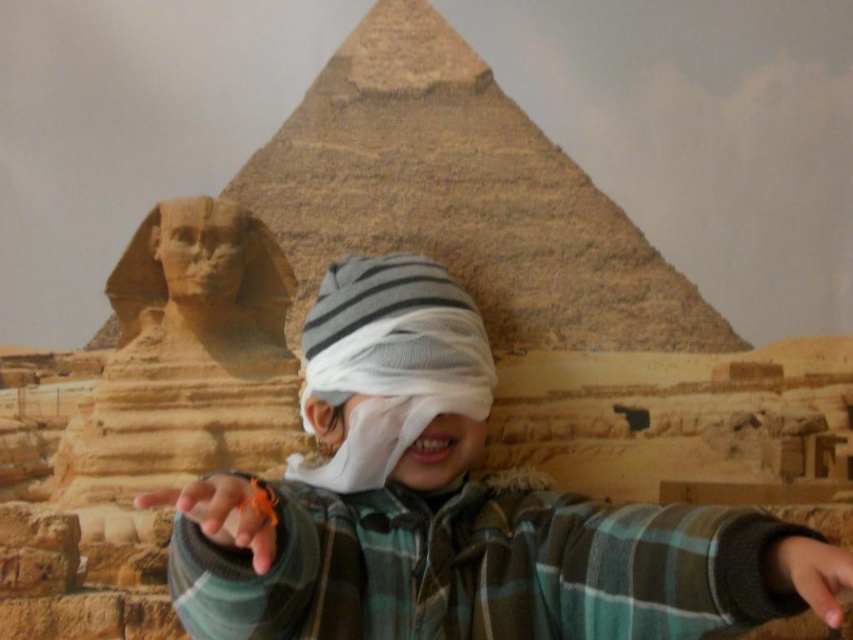
From the picture: You are a photographer setting up a shot of the smooth stone sphinx at center and the orange string at center. The camera is placed at a position where both objects are visible. If the camera has a focal length of 50mm and the distance between the two objects is 51.12 feet, what is the minimum distance in feet the camera should be from the objects to ensure both are fully in frame?

The minimum distance the camera should be from the objects is 51.12 feet divided by the field of view of the camera lens. However, without knowing the field of view, we can only state that the distance between the smooth stone sphinx at center and the orange string at center is 51.12 feet.

You are taking a photo of the scene and want to focus on both the child and the model of the Great Sphinx and Pyramid of Giza. The points you need to focus on are point [169,266] and point [141,508]. Which point is closer to your camera?

Point [169,266] is further to the camera than point [141,508], so the closer point to your camera is point [141,508].

You are a photographer setting up a shoot with a child and a miniature Egyptian scene. The child is wearing a white fabric headscarf at center and has a smooth skin hand at lower right. To ensure the headscarf doesn not block the miniature background, should you adjust the hand position?

The smooth skin hand at lower right is behind the white fabric headscarf at center, so moving the hand forward would prevent it from blocking the headscarf and allow the background to be visible.